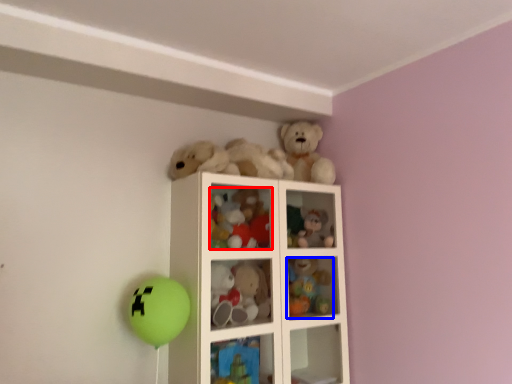
Question: Which object is closer to the camera taking this photo, toy (highlighted by a red box) or toy (highlighted by a blue box)?

Choices:
 (A) toy
 (B) toy

Answer: (A)